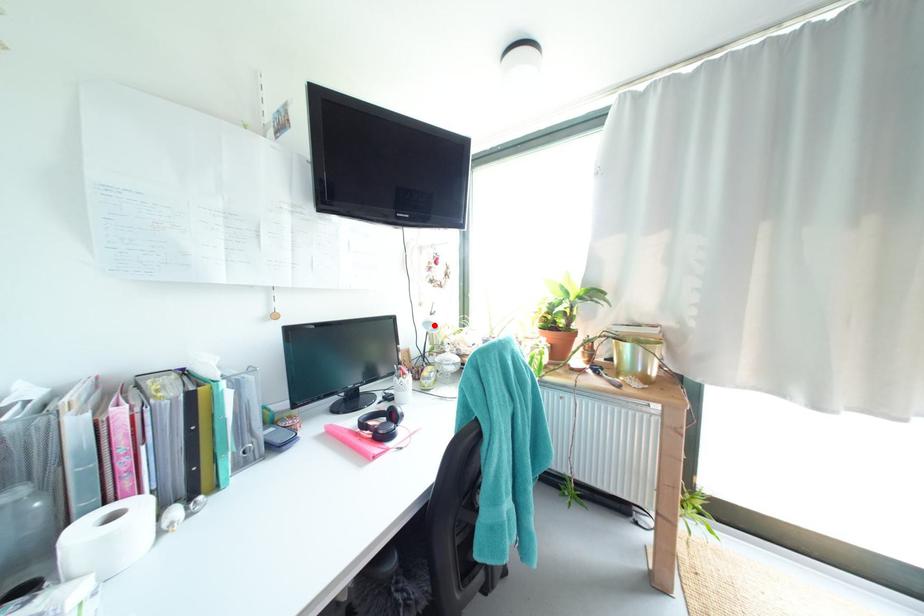
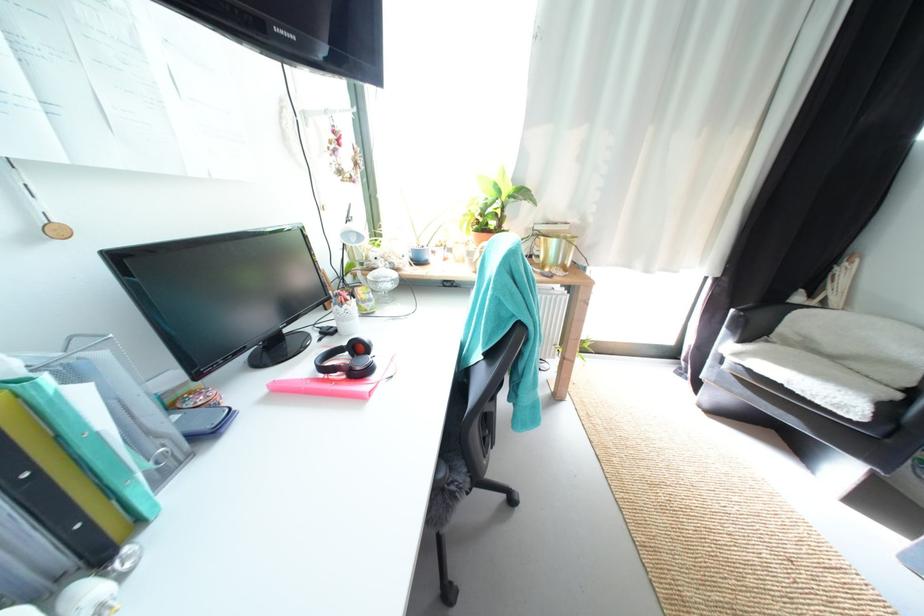
Locate, in the second image, the point that corresponds to the highlighted location in the first image.

(354, 236)